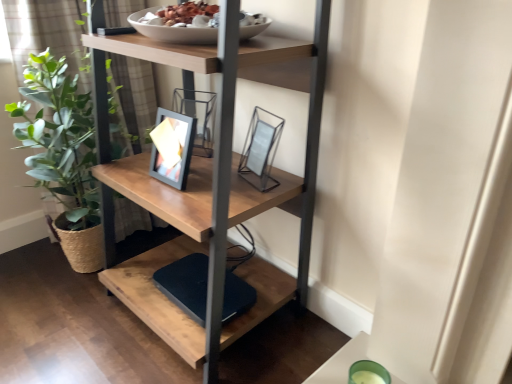
Question: From the image's perspective, would you say wooden shelf at center is positioned over black matte lift at lower center?

Choices:
 (A) no
 (B) yes

Answer: (B)

Question: Is there a large distance between wooden shelf at center and black matte lift at lower center?

Choices:
 (A) no
 (B) yes

Answer: (A)

Question: From a real-world perspective, is wooden shelf at center positioned over black matte lift at lower center based on gravity?

Choices:
 (A) no
 (B) yes

Answer: (B)

Question: Does wooden shelf at center come in front of black matte lift at lower center?

Choices:
 (A) no
 (B) yes

Answer: (B)

Question: Is wooden shelf at center positioned with its back to black matte lift at lower center?

Choices:
 (A) yes
 (B) no

Answer: (B)

Question: Considering the relative sizes of wooden shelf at center and black matte lift at lower center in the image provided, is wooden shelf at center wider than black matte lift at lower center?

Choices:
 (A) yes
 (B) no

Answer: (A)

Question: Is green leafy plant at left wider than black matte lift at lower center?

Choices:
 (A) no
 (B) yes

Answer: (B)

Question: Are green leafy plant at left and black matte lift at lower center far apart?

Choices:
 (A) no
 (B) yes

Answer: (A)

Question: Does green leafy plant at left lie in front of black matte lift at lower center?

Choices:
 (A) no
 (B) yes

Answer: (A)

Question: From the image's perspective, is green leafy plant at left located beneath black matte lift at lower center?

Choices:
 (A) yes
 (B) no

Answer: (B)

Question: Considering the relative sizes of green leafy plant at left and black matte lift at lower center in the image provided, is green leafy plant at left smaller than black matte lift at lower center?

Choices:
 (A) no
 (B) yes

Answer: (A)

Question: Is the position of green leafy plant at left more distant than that of black matte lift at lower center?

Choices:
 (A) no
 (B) yes

Answer: (B)

Question: Is black matte lift at lower center turned away from metallic glass picture frame at center?

Choices:
 (A) no
 (B) yes

Answer: (A)